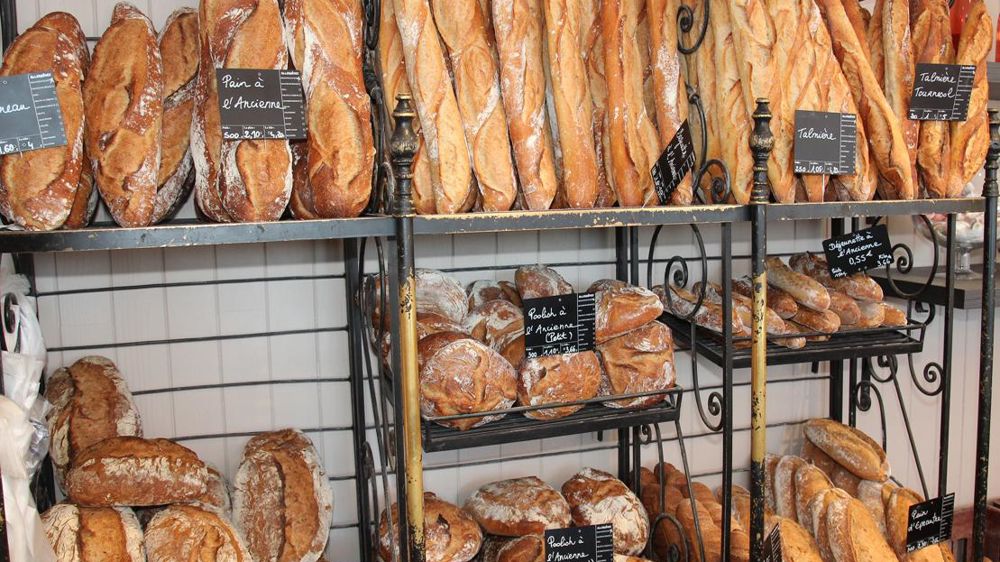
This screenshot has width=1000, height=562. In order to click on shelf in this screenshot , I will do `click(210, 234)`, `click(556, 217)`, `click(917, 206)`, `click(532, 426)`, `click(834, 352)`.